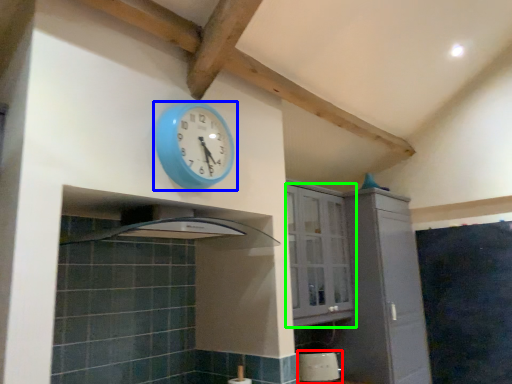
Question: Which is farther away from appliance (highlighted by a red box)? wall clock (highlighted by a blue box) or cabinetry (highlighted by a green box)?

Choices:
 (A) wall clock
 (B) cabinetry

Answer: (A)